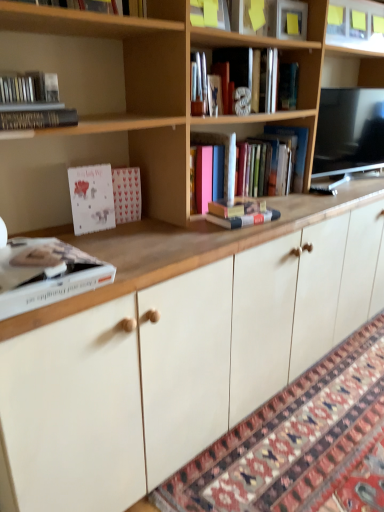
I want to click on unoccupied area behind white matte book at lower left, acting as the 5th book starting from the right, so click(x=95, y=239).